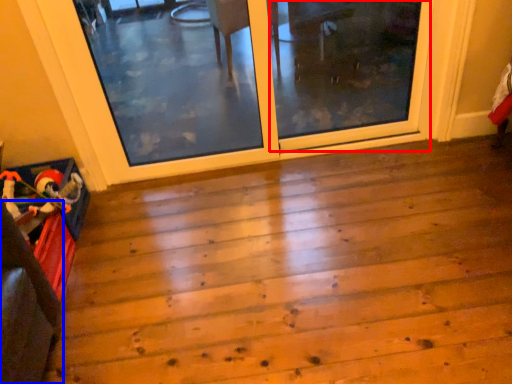
Question: Among these objects, which one is farthest to the camera, screen door (highlighted by a red box) or furniture (highlighted by a blue box)?

Choices:
 (A) screen door
 (B) furniture

Answer: (A)